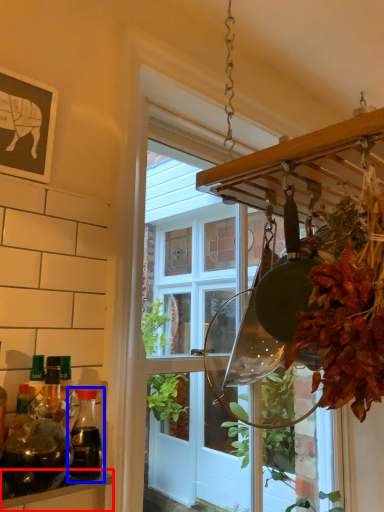
Question: Which of the following is the closest to the observer, shelf (highlighted by a red box) or bottle (highlighted by a blue box)?

Choices:
 (A) shelf
 (B) bottle

Answer: (A)